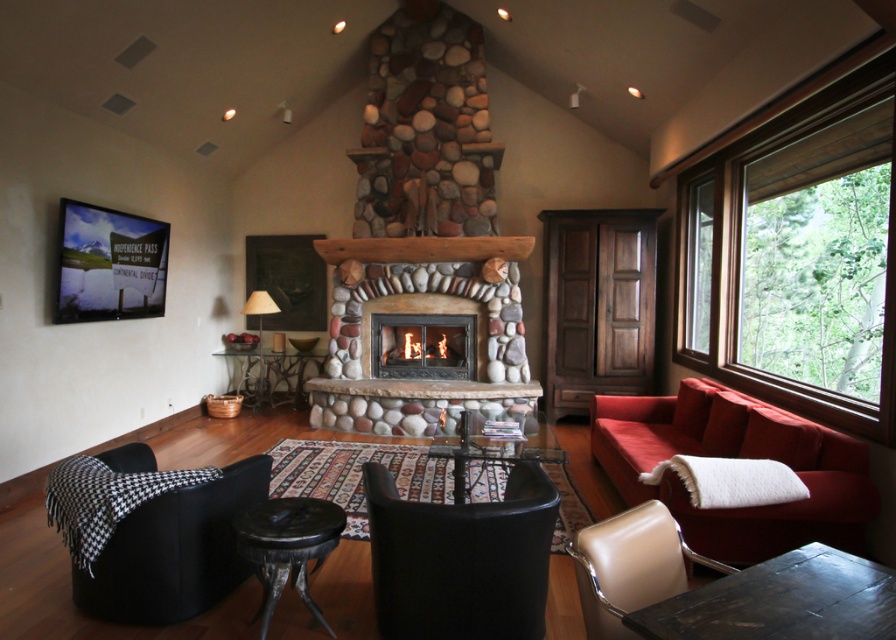
You are standing in the living room and want to place a 1.5 meter long sofa in front of the natural stone fireplace at center. Is there enough space between you and the fireplace to accommodate the sofa?

The natural stone fireplace at center is 5.62 meters away from the viewer. Since the sofa is 1.5 meters long, there is sufficient space as 5.62 meters is greater than 1.5 meters.

You are standing in the living room and want to place a decorative item on the wooden frame at right. Where exactly should you place it?

The wooden frame at right is located at point (798, 257), so you should place the decorative item there.

You are an interior designer assessing the living room layout. You notice the wooden frame at right and the natural stone fireplace at center. Which object has a greater height in the room?

The wooden frame at right is much taller than the natural stone fireplace at center, so the wooden frame at right has a greater height in the room.